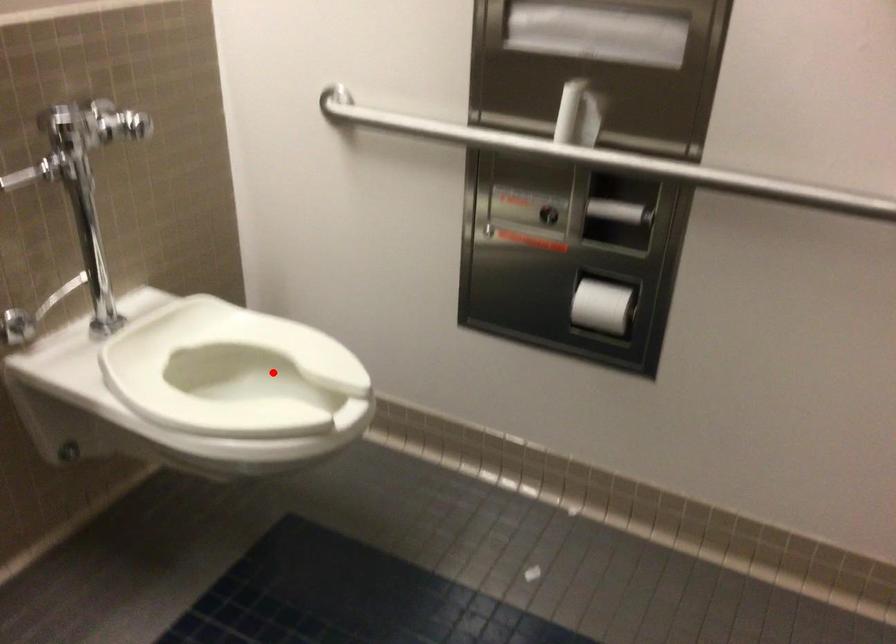
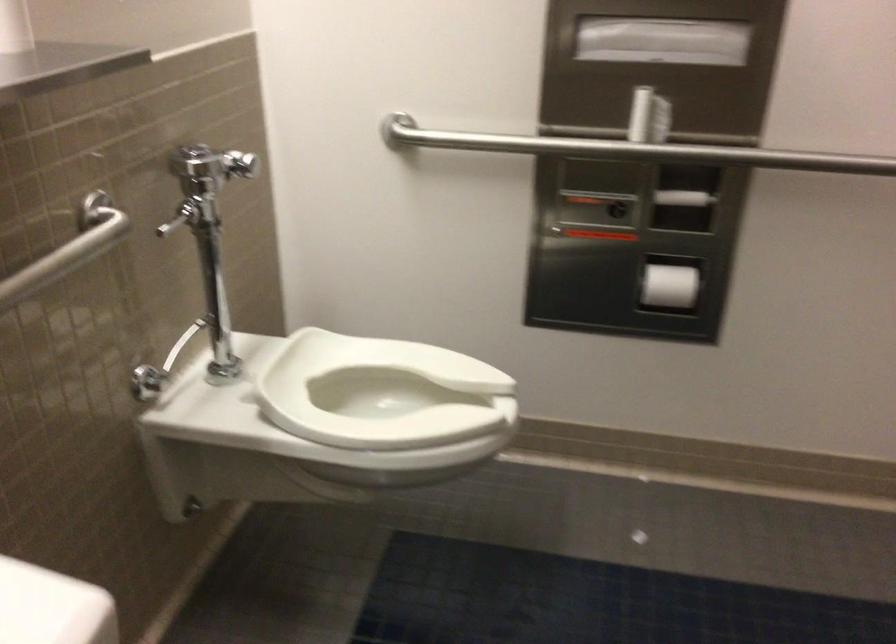
In the second image, find the point that corresponds to the highlighted location in the first image.

(381, 393)